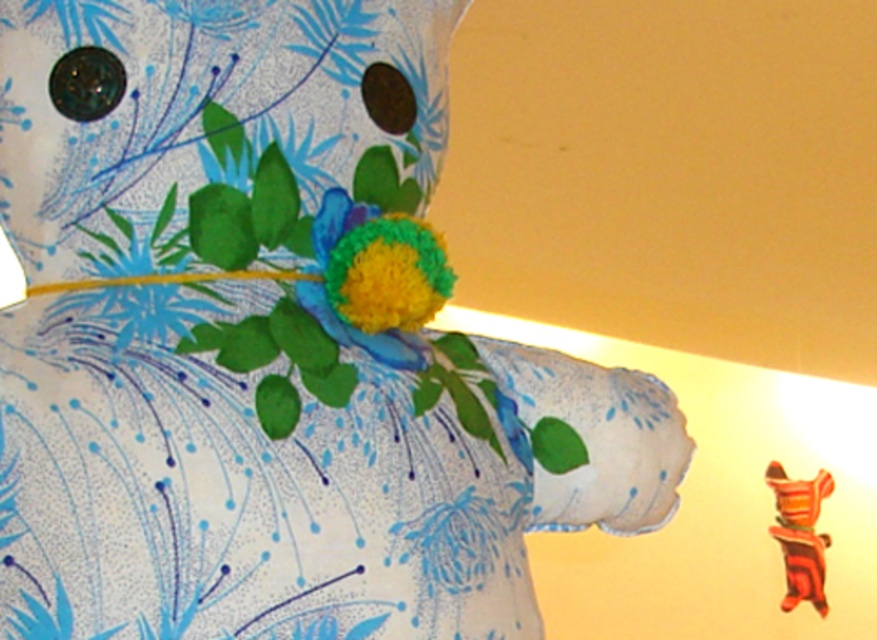
Who is more forward, (x=428, y=273) or (x=790, y=561)?

Positioned in front is point (x=428, y=273).

Is fluffy yellow-green flower at center taller than striped fabric toy at center?

No.

This screenshot has height=640, width=877. What are the coordinates of `fluffy yellow-green flower at center` in the screenshot? It's located at (375, 280).